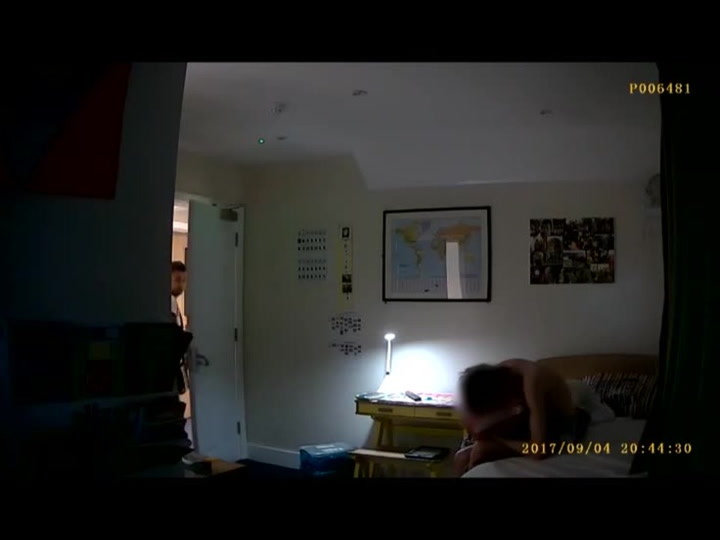
Find the location of a particular element. This screenshot has width=720, height=540. door is located at coordinates (204, 301).